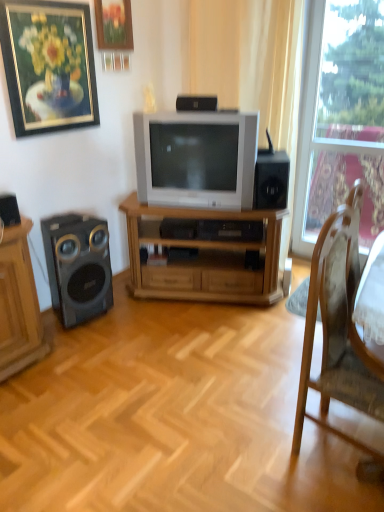
The height and width of the screenshot is (512, 384). Identify the location of unoccupied region to the right of matte black speaker at left. (133, 315).